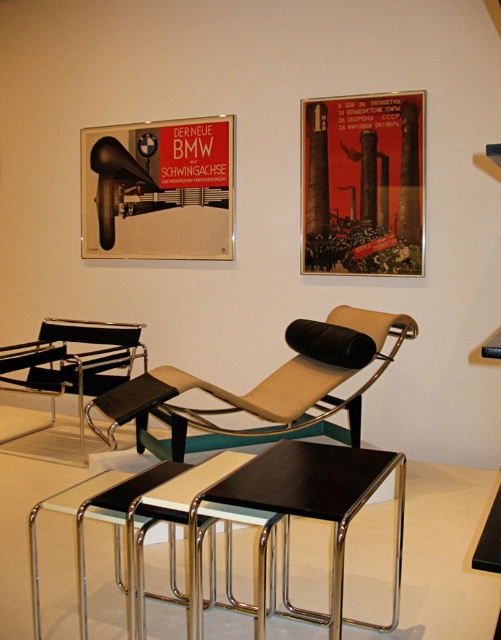
You are an interior designer planning to hang a new artwork between the red paper poster at upper center and the beige leather chaise lounge at center. Which object should the artwork be placed above to ensure it aligns with the height of the taller one?

The red paper poster at upper center is taller than the beige leather chaise lounge at center, so the artwork should be placed above the red paper poster at upper center to align with its height.

You are standing in the exhibition space and notice two points marked on the wall. The first point is at coordinates point[156,376] and the second at point[333,541]. Which point is closer to the lounge chair?

Point[156,376] is behind point[333,541], so the closer point to the lounge chair would be point[333,541] since it is in front.